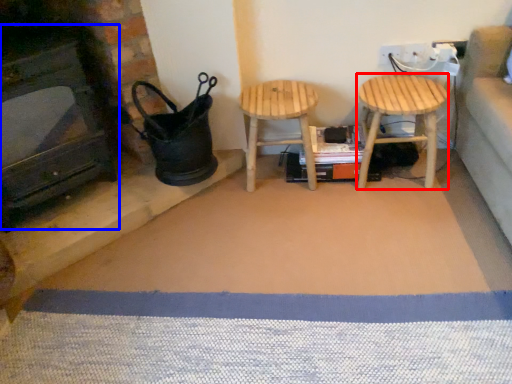
Question: Among these objects, which one is farthest to the camera, stool (highlighted by a red box) or fireplace (highlighted by a blue box)?

Choices:
 (A) stool
 (B) fireplace

Answer: (A)